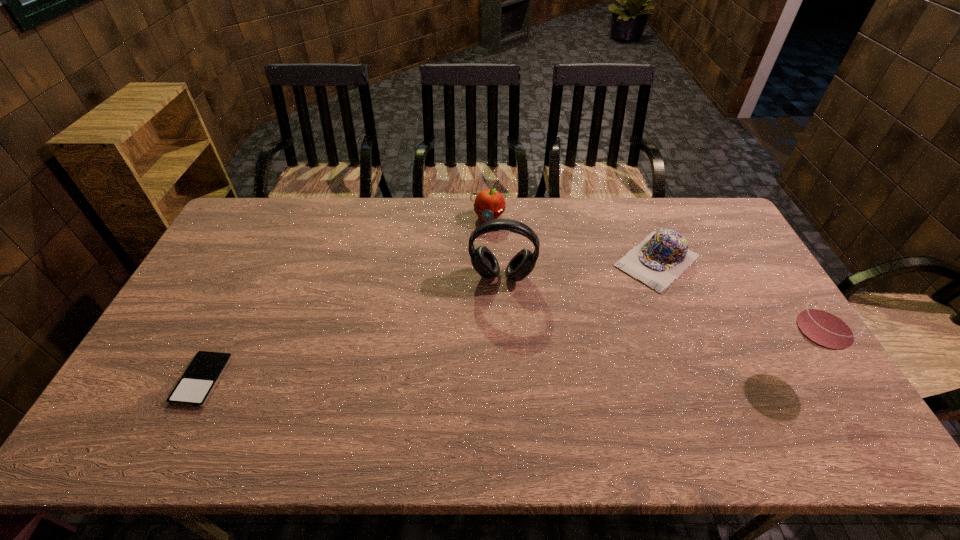
Identify the location of free space located 0.250m on the earcups of the headset. (492, 355).

You are a GUI agent. You are given a task and a screenshot of the screen. Output one action in this format:
    pyautogui.click(x=<x>, y=<y>)
    Task: Click on the vacant space situated on the earcups of the headset
    
    Given the screenshot: What is the action you would take?
    pyautogui.click(x=493, y=342)

I want to click on free space located on the earcups of the headset, so click(496, 318).

I want to click on vacant space located on the front, side, and top of the second object from right to left, so click(x=561, y=348).

Find the location of a particular element. This screenshot has width=960, height=540. vacant position located 0.230m on the front, side, and top of the second object from right to left is located at coordinates (588, 323).

You are a GUI agent. You are given a task and a screenshot of the screen. Output one action in this format:
    pyautogui.click(x=<x>, y=<y>)
    Task: Click on the vacant space situated 0.320m on the front, side, and top of the second object from right to left
    The width and height of the screenshot is (960, 540).
    Given the screenshot: What is the action you would take?
    pyautogui.click(x=567, y=341)

The width and height of the screenshot is (960, 540). I want to click on vacant space located 0.360m on the surface of the third tallest object, so click(x=467, y=303).

Find the location of a particular element. vacant space located 0.250m on the surface of the third tallest object is located at coordinates (473, 277).

The height and width of the screenshot is (540, 960). Find the location of `vacant space situated 0.190m on the surface of the third tallest object`. vacant space situated 0.190m on the surface of the third tallest object is located at coordinates (476, 264).

I want to click on cap that is at the far edge, so click(661, 258).